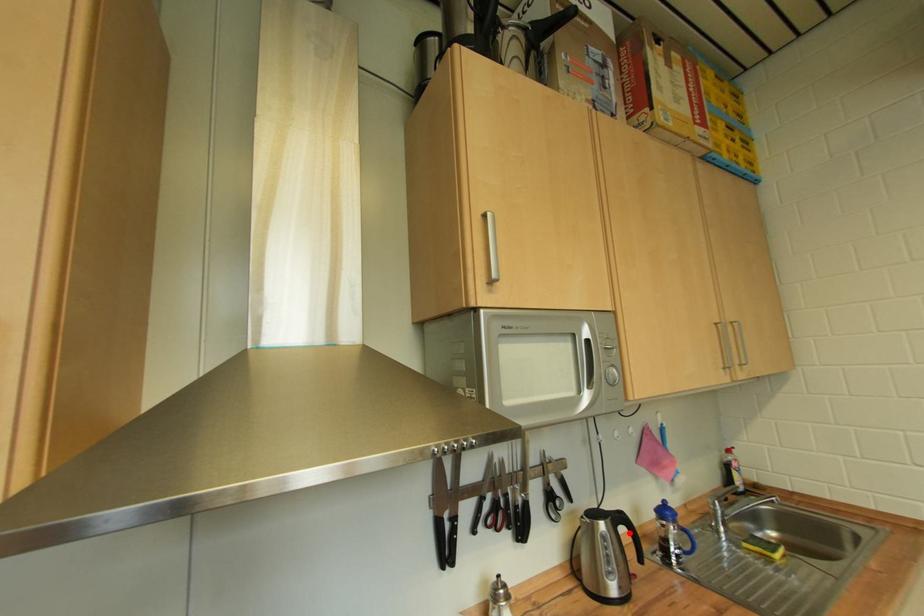
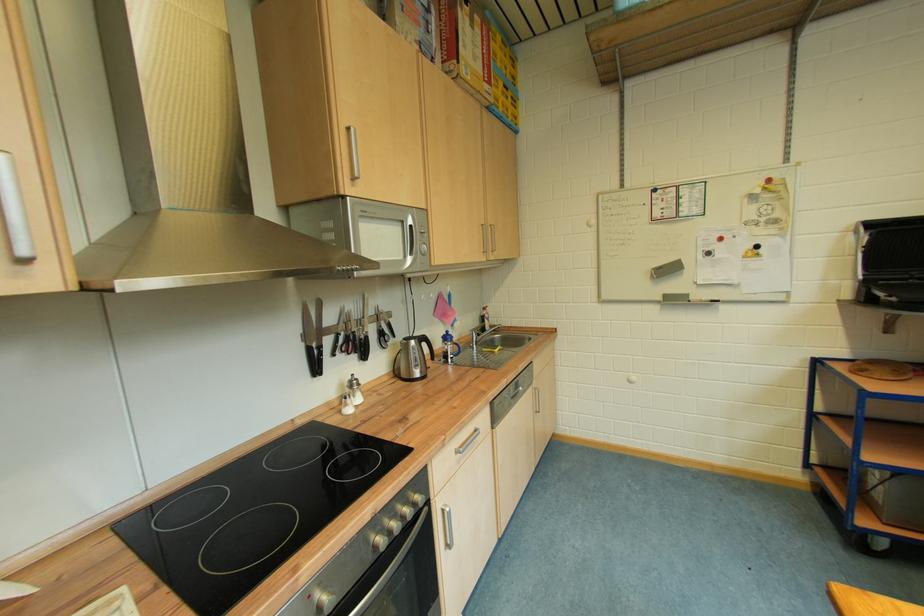
Question: I am providing you with two images of the same scene from different viewpoints. A red point is marked on the first image. Is the red point's position out of view in image 2?

Choices:
 (A) Yes
 (B) No

Answer: (B)